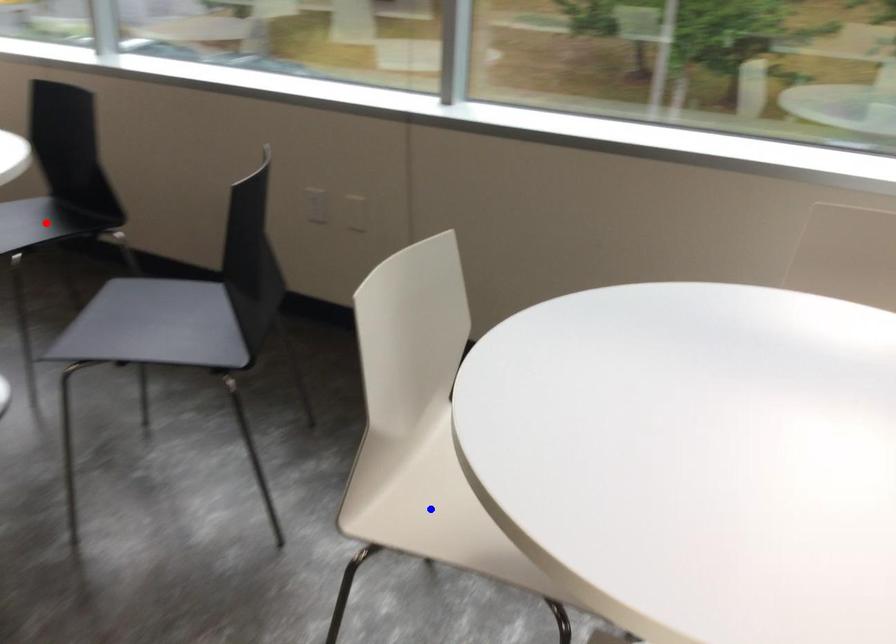
Question: Two points are marked on the image. Which point is closer to the camera?

Choices:
 (A) Blue point is closer.
 (B) Red point is closer.

Answer: (A)